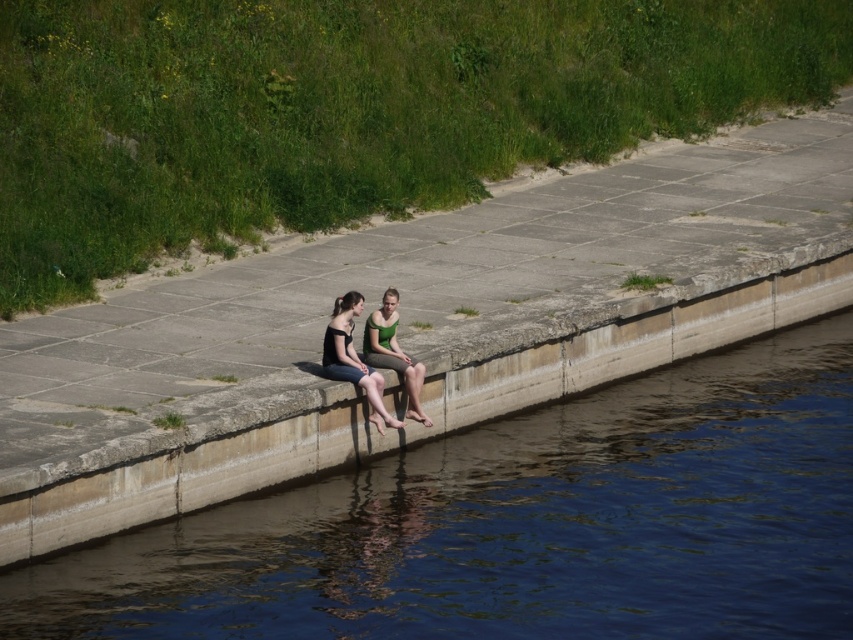
Question: Does blue smooth water at lower center have a lesser width compared to green matte dress at center?

Choices:
 (A) no
 (B) yes

Answer: (A)

Question: Which point is closer to the camera?

Choices:
 (A) matte black tank top at center
 (B) green matte dress at center
 (C) blue smooth water at lower center

Answer: (C)

Question: Which point is farther to the camera?

Choices:
 (A) green matte dress at center
 (B) matte black tank top at center
 (C) blue smooth water at lower center

Answer: (A)

Question: Does blue smooth water at lower center have a larger size compared to matte black tank top at center?

Choices:
 (A) no
 (B) yes

Answer: (B)

Question: Which point is closer to the camera?

Choices:
 (A) green matte dress at center
 (B) matte black tank top at center
 (C) blue smooth water at lower center

Answer: (C)

Question: Can you confirm if matte black tank top at center is positioned below green matte dress at center?

Choices:
 (A) no
 (B) yes

Answer: (B)